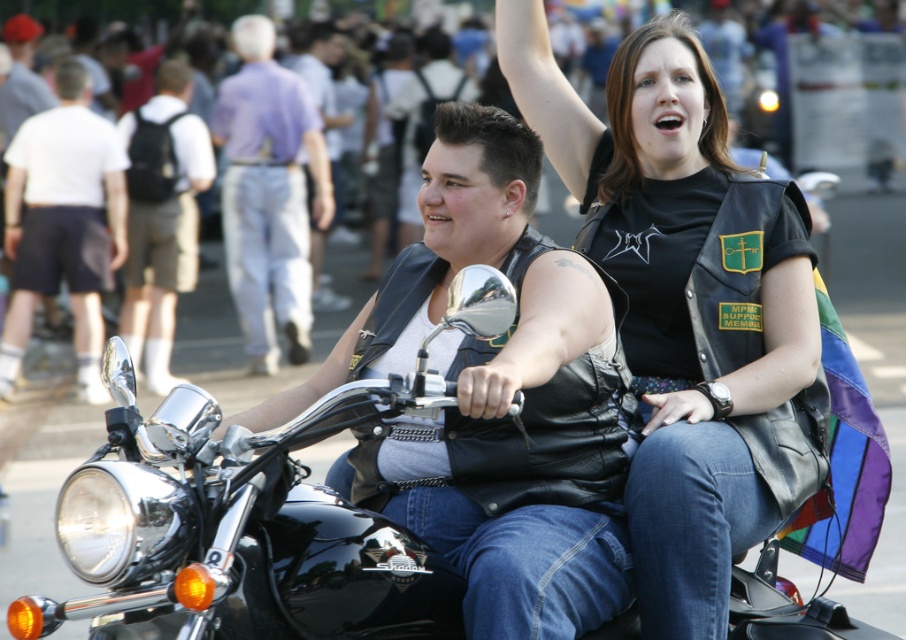
From the picture: You are a photographer standing at the origin point of the coordinate system. You want to take a photo of the black leather motorcycle at center. What are the coordinates where you should aim your camera?

The coordinates to aim your camera are at point (334, 573), which is where the black leather motorcycle at center is located.

You are a photographer at the event and want to capture both the black leather vest at upper center and the light purple shirt at center in the same frame. Which object should you position your camera closer to in order to include both?

To include both the black leather vest at upper center and the light purple shirt at center in the same frame, position your camera closer to the light purple shirt at center since the black leather vest at upper center is to the right of it, allowing for a wider shot that captures both objects.